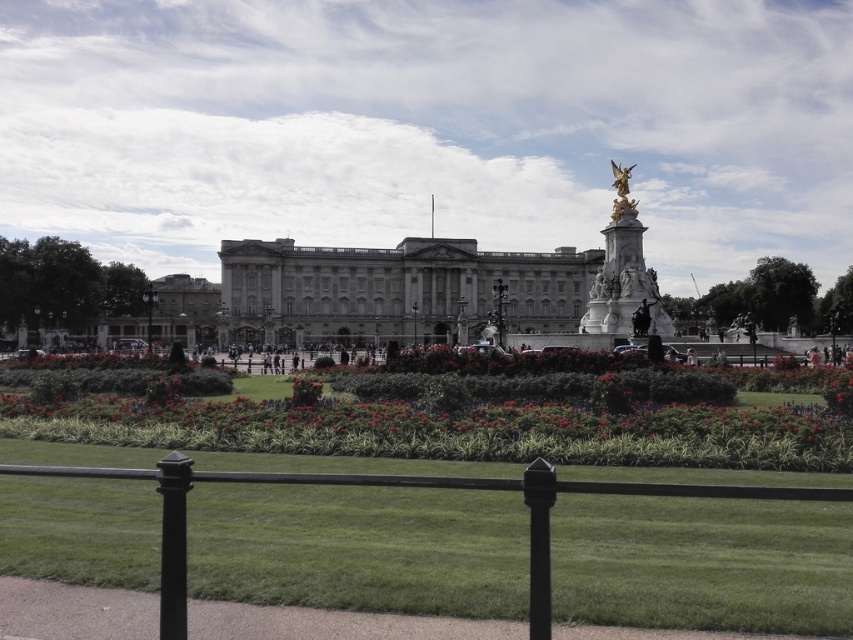
You are a tourist standing in front of the black metal railing. You want to take a photo of the white stone building at center and the white marble statue at upper right. Which object should you point your camera upwards to capture?

You should point your camera upwards to capture the white stone building at center because it is located above the white marble statue at upper right.

You are standing at the point marked as point (393, 289) in the image. What object is located exactly at that point?

The point (393, 289) is occupied by the white stone building at center.

You are standing in front of the Buckingham Palace scene. You see the white stone building at center and the black metal fence at lower center. Which object is positioned to the right side of the other?

The white stone building at center is to the right of the black metal fence at lower center.